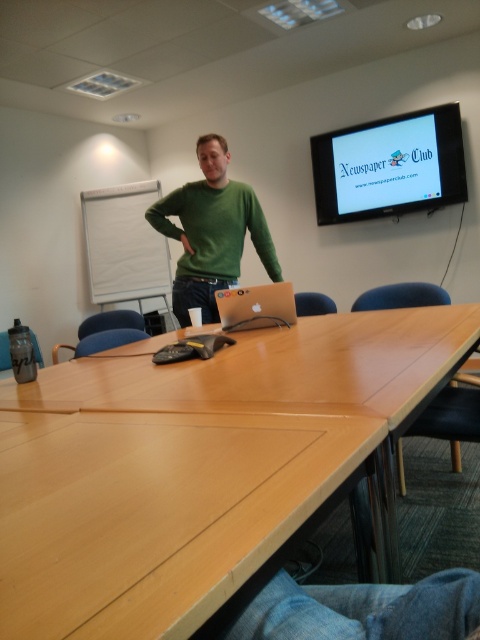
Question: Is light brown wood table at center to the left of silver metallic laptop at center from the viewer's perspective?

Choices:
 (A) yes
 (B) no

Answer: (A)

Question: Is matte plastic screen at upper right positioned at the back of green matte sweater at center?

Choices:
 (A) no
 (B) yes

Answer: (B)

Question: Among these points, which one is nearest to the camera?

Choices:
 (A) (370, 125)
 (B) (301, 452)
 (C) (216, 195)

Answer: (B)

Question: Is green matte sweater at center above silver metallic laptop at center?

Choices:
 (A) no
 (B) yes

Answer: (B)

Question: Which is nearer to the green matte sweater at center?

Choices:
 (A) matte plastic screen at upper right
 (B) silver metallic laptop at center
 (C) light brown wood table at center

Answer: (B)

Question: Which of the following is the farthest from the observer?

Choices:
 (A) light brown wood table at center
 (B) silver metallic laptop at center

Answer: (B)